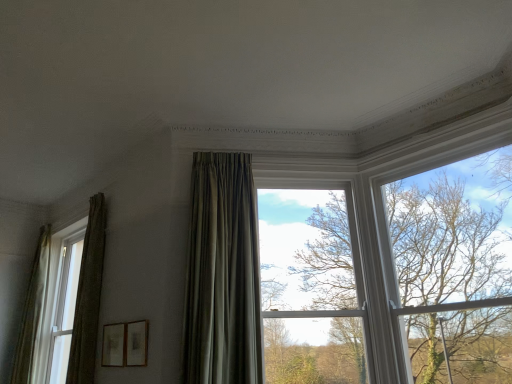
Question: From the image's perspective, is green textured curtain at left, acting as the 2th curtain starting from the back, positioned above or below matte white window at left, marked as the 2th window in a right-to-left arrangement?

Choices:
 (A) above
 (B) below

Answer: (A)

Question: Would you say green textured curtain at left, the 2th curtain viewed from the front, is to the left or to the right of matte white window at left, the 1th window when ordered from back to front, in the picture?

Choices:
 (A) right
 (B) left

Answer: (A)

Question: Which of these objects is positioned closest to the green textured curtain at left, acting as the 2th curtain starting from the back?

Choices:
 (A) wooden picture frame at lower center, which is counted as the 2th picture frame, starting from the left
 (B) silky green curtain at left, the 1th curtain viewed from the back
 (C) matte white window at left, the 1th window when ordered from back to front
 (D) matte gold picture frame at lower left, which is the 2th picture frame from right to left
 (E) satin green curtain at center, arranged as the third curtain when viewed from the left

Answer: (D)

Question: Considering the real-world distances, which object is closest to the silky green curtain at left, the 1th curtain viewed from the back?

Choices:
 (A) matte white window at left, which is counted as the first window, starting from the left
 (B) clear glass window at center, the 1th window when ordered from right to left
 (C) satin green curtain at center, marked as the 1th curtain in a right-to-left arrangement
 (D) matte gold picture frame at lower left, placed as the first picture frame when sorted from left to right
 (E) bare branches at upper right

Answer: (A)